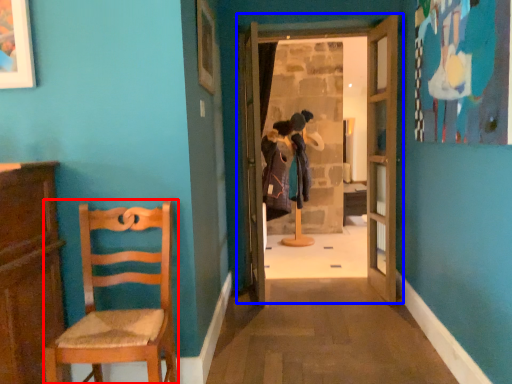
Question: Which object appears farthest to the camera in this image, chair (highlighted by a red box) or door (highlighted by a blue box)?

Choices:
 (A) chair
 (B) door

Answer: (B)